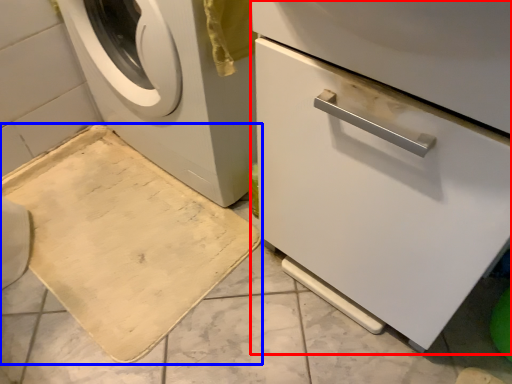
Question: Among these objects, which one is nearest to the camera, machine (highlighted by a red box) or bath mat (highlighted by a blue box)?

Choices:
 (A) machine
 (B) bath mat

Answer: (A)